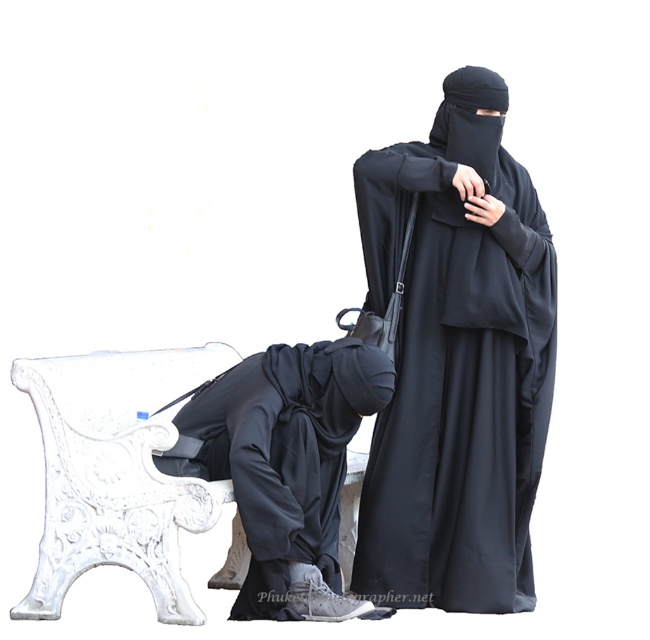
You are a security guard observing the scene. You notice two people near the white ornate bench. The person on the left is seated, wearing a black matte niqab at center, and the person on the right is standing, wearing matte black clothing at lower left. Which individual is closer to you?

The black matte niqab at center is closer to you than the matte black clothing at lower left, so the seated person on the left is closer to you.

You are a photographer setting up a shoot in this scene. You need to place a 1 meter long prop between the black matte niqab at center and the matte black clothing at lower left. Will there be enough space?

The distance between the black matte niqab at center and the matte black clothing at lower left is 73.83 centimeters. Since the prop is 1 meter long, which is longer than the available space, it won not fit between them.

You are a photographer positioned at the center of the scene. You need to place a spotlight on the closest point between point (528, 186) and point (291, 380). Which point should you choose?

Point (291, 380) is closer to the viewer than point (528, 186), so you should place the spotlight on point (291, 380).